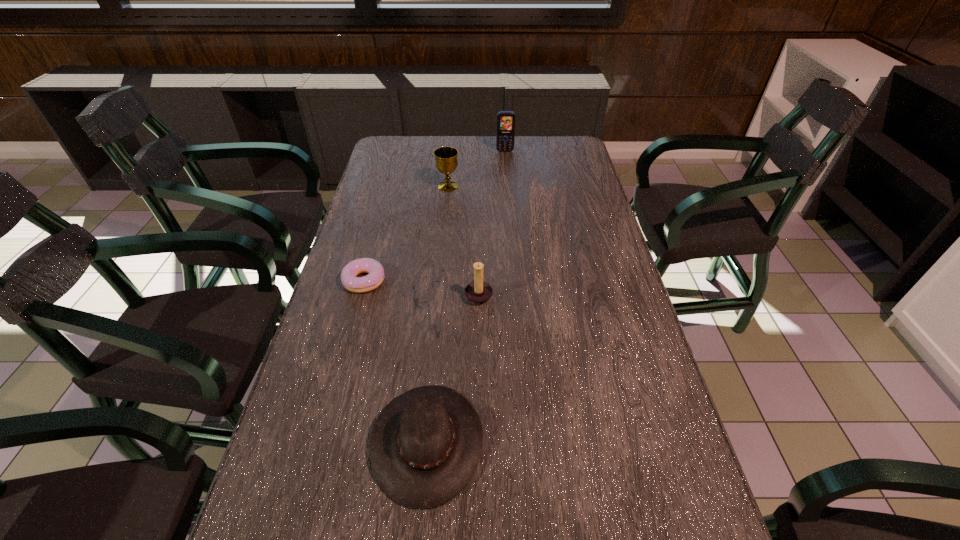
Identify the location of free space that is in between the hat and the fourth nearest object. (438, 314).

Where is `vacant area between the doughnut and the rightmost object`? This screenshot has width=960, height=540. vacant area between the doughnut and the rightmost object is located at coordinates pyautogui.click(x=435, y=216).

Image resolution: width=960 pixels, height=540 pixels. Find the location of `free spot between the fourth nearest object and the tallest object`. free spot between the fourth nearest object and the tallest object is located at coordinates (476, 168).

You are a GUI agent. You are given a task and a screenshot of the screen. Output one action in this format:
    pyautogui.click(x=<x>, y=<y>)
    Task: Click on the free space between the hat and the leftmost object
    Image resolution: width=960 pixels, height=540 pixels.
    Given the screenshot: What is the action you would take?
    pyautogui.click(x=396, y=361)

Identify the location of free spot between the fourth nearest object and the doughnut. The height and width of the screenshot is (540, 960). (406, 233).

The image size is (960, 540). Identify the location of unoccupied area between the fourth tallest object and the chalice. (438, 314).

You are a GUI agent. You are given a task and a screenshot of the screen. Output one action in this format:
    pyautogui.click(x=<x>, y=<y>)
    Task: Click on the empty space that is in between the second farthest object and the cellular telephone
    This screenshot has width=960, height=540.
    Given the screenshot: What is the action you would take?
    pyautogui.click(x=476, y=168)

Where is `object that can be found as the third closest to the candle holder`? This screenshot has width=960, height=540. object that can be found as the third closest to the candle holder is located at coordinates (446, 162).

Choose which object is the second nearest neighbor to the rightmost object. Please provide its 2D coordinates. Your answer should be formatted as a tuple, i.e. [(x, y)], where the tuple contains the x and y coordinates of a point satisfying the conditions above.

[(478, 292)]

Where is `blank space that satisfies the following two spatial constraints: 1. on the screen of the tallest object; 2. on the wick of the candle holder`? The image size is (960, 540). blank space that satisfies the following two spatial constraints: 1. on the screen of the tallest object; 2. on the wick of the candle holder is located at coordinates (516, 294).